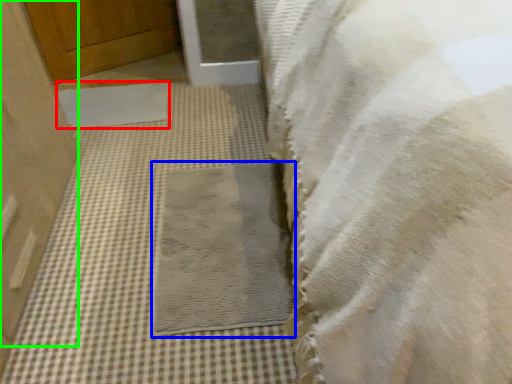
Question: Considering the real-world distances, which object is closest to mat (highlighted by a red box)? mat (highlighted by a blue box) or door (highlighted by a green box).

Choices:
 (A) mat
 (B) door

Answer: (B)